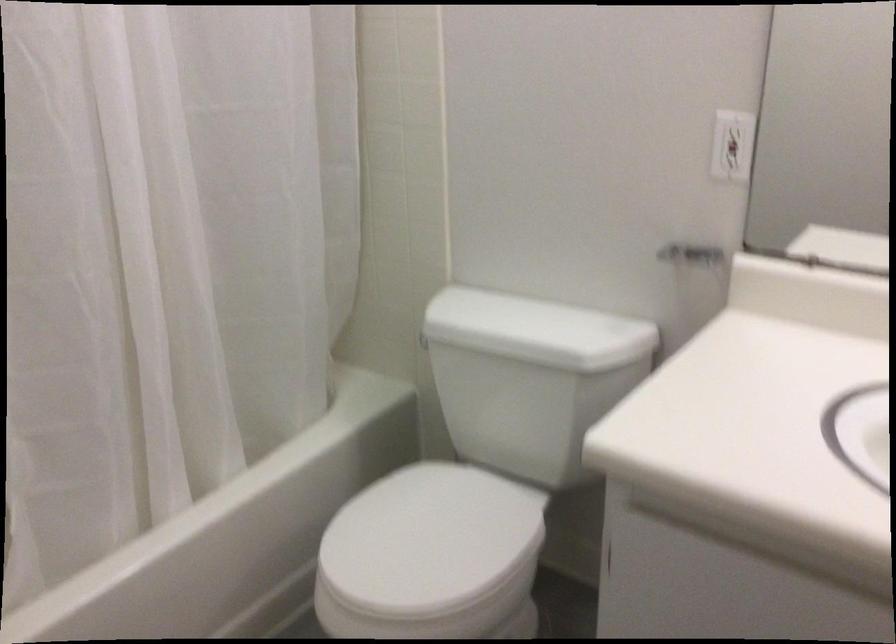
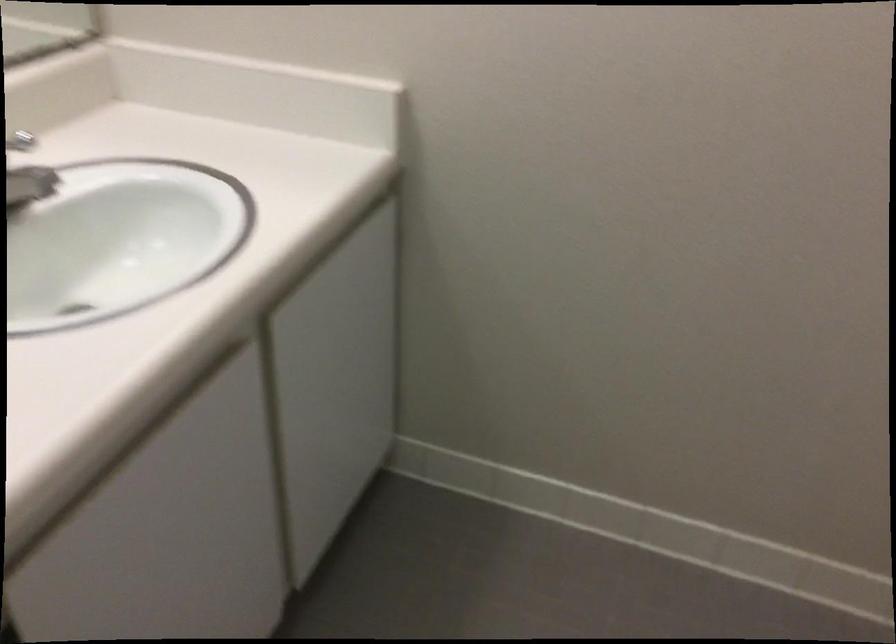
The first image is from the beginning of the video and the second image is from the end. How did the camera likely rotate when shooting the video?

The camera rotated toward right-down.